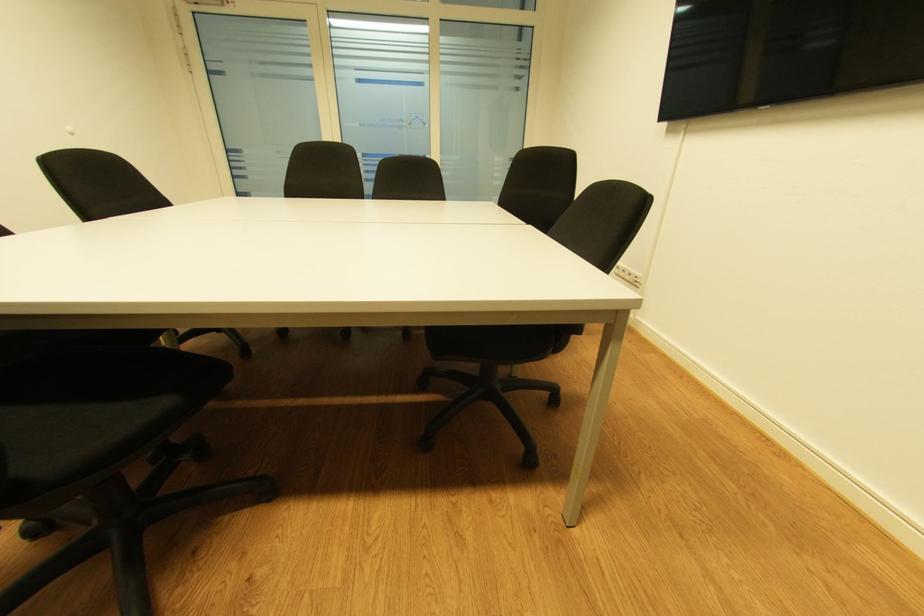
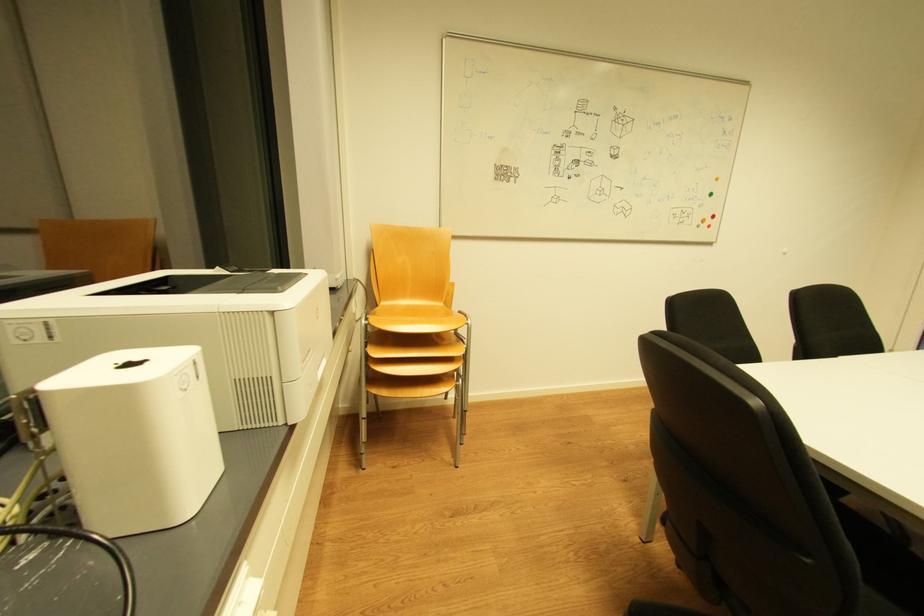
Question: The first image is from the beginning of the video and the second image is from the end. How did the camera likely rotate when shooting the video?

Choices:
 (A) Left
 (B) Right
 (C) Up
 (D) Down

Answer: (A)